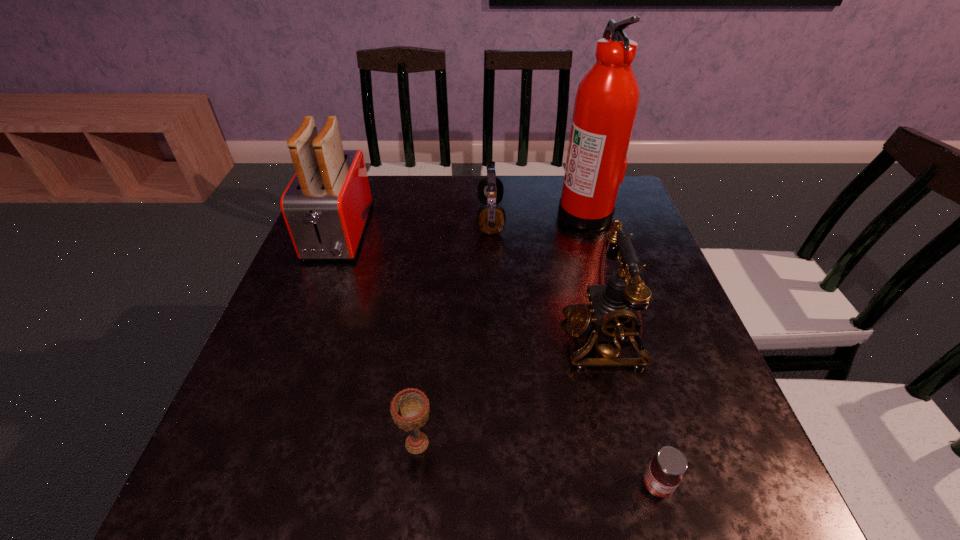
At what (x,y) coordinates should I click in order to perform the action: click on free region located 0.390m on the ear cups of the third shortest object. Please return your answer as a coordinate pair (x, y). The image size is (960, 540). Looking at the image, I should click on (339, 218).

The width and height of the screenshot is (960, 540). I want to click on free region located on the back of the fifth farthest object, so click(433, 295).

Where is `fire extinguisher at the far edge`? fire extinguisher at the far edge is located at coordinates (607, 99).

The image size is (960, 540). I want to click on toaster that is positioned at the far edge, so click(x=326, y=205).

The height and width of the screenshot is (540, 960). I want to click on headset situated at the far edge, so click(x=491, y=217).

This screenshot has width=960, height=540. In order to click on object that is at the near edge in this screenshot , I will do `click(663, 475)`.

Locate an element on the screen. The width and height of the screenshot is (960, 540). object that is at the left edge is located at coordinates [x=326, y=205].

Locate an element on the screen. fire extinguisher present at the right edge is located at coordinates (607, 99).

Identify the location of telephone at the right edge. This screenshot has width=960, height=540. (612, 313).

Find the location of a particular element. Image resolution: width=960 pixels, height=540 pixels. jam present at the right edge is located at coordinates (663, 475).